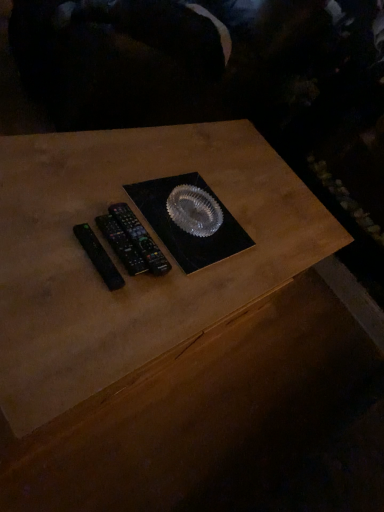
Identify the location of unoccupied region to the right of black plastic remote controls at center, acting as the 3th control starting from the front. (192, 290).